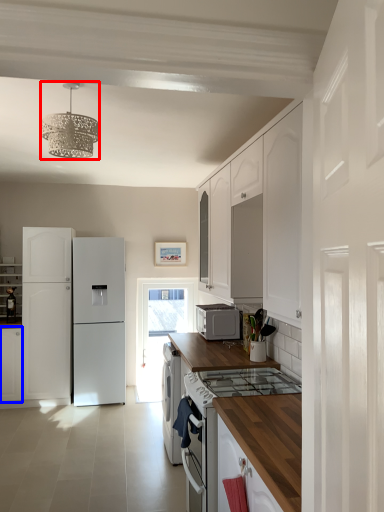
Question: Which of the following is the closest to the observer, light fixture (highlighted by a red box) or cabinetry (highlighted by a blue box)?

Choices:
 (A) light fixture
 (B) cabinetry

Answer: (A)